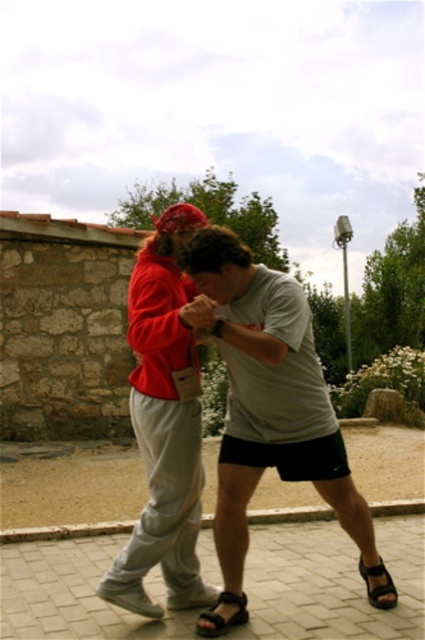
Question: Which object appears farthest from the camera in this image?

Choices:
 (A) black leather sandal at lower center
 (B) gray cotton t-shirt at center

Answer: (A)

Question: Observing the image, what is the correct spatial positioning of matte red hoodie at center in reference to black leather sandal at lower center?

Choices:
 (A) right
 (B) left

Answer: (B)

Question: Estimate the real-world distances between objects in this image. Which object is closer to the gray cotton t-shirt at center?

Choices:
 (A) black leather sandal at lower right
 (B) matte red hoodie at center

Answer: (B)

Question: Is gray cotton t-shirt at center bigger than black leather sandal at lower right?

Choices:
 (A) no
 (B) yes

Answer: (B)

Question: Which object is positioned farthest from the matte red hoodie at center?

Choices:
 (A) black leather sandal at lower center
 (B) gray cotton t-shirt at center

Answer: (A)

Question: Does matte red hoodie at center appear over black leather sandal at lower right?

Choices:
 (A) yes
 (B) no

Answer: (A)